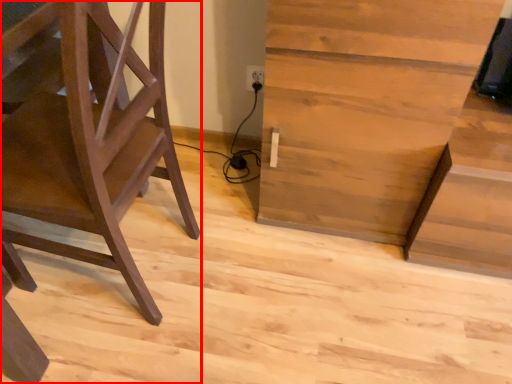
Question: From the image's perspective, what is the correct spatial relationship of furniture (annotated by the red box) in relation to table?

Choices:
 (A) above
 (B) below

Answer: (B)